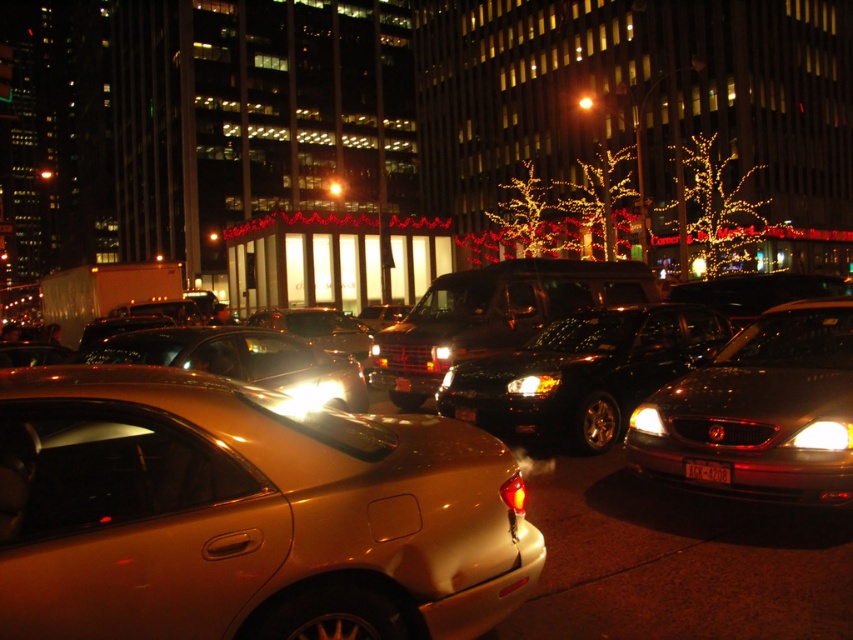
Which of these two, gold metallic car at center or glossy black car at center, stands taller?

Standing taller between the two is glossy black car at center.

Measure the distance between point (x=125, y=564) and camera.

Point (x=125, y=564) and camera are 2.42 meters apart from each other.

The width and height of the screenshot is (853, 640). Find the location of `gold metallic car at center`. gold metallic car at center is located at coordinates (247, 515).

From the picture: Who is more forward, (711, 474) or (647, 419)?

Positioned in front is point (711, 474).

Can you confirm if black plastic license plate at center is positioned to the left of matte gold headlight at center-right?

No, black plastic license plate at center is not to the left of matte gold headlight at center-right.

Describe the element at coordinates (706, 470) in the screenshot. The image size is (853, 640). I see `black plastic license plate at center` at that location.

Identify the location of black plastic license plate at center. The image size is (853, 640). (706, 470).

Does shiny black sedan at center have a smaller size compared to white glossy headlight at center?

Incorrect, shiny black sedan at center is not smaller in size than white glossy headlight at center.

Is shiny black sedan at center shorter than white glossy headlight at center?

Incorrect, shiny black sedan at center's height does not fall short of white glossy headlight at center's.

Locate an element on the screen. This screenshot has width=853, height=640. shiny black sedan at center is located at coordinates (761, 408).